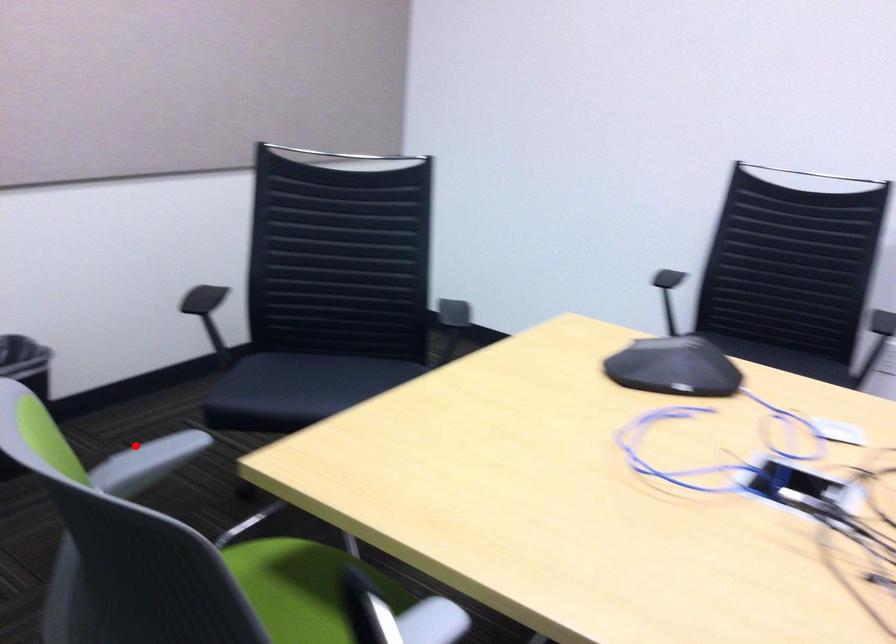
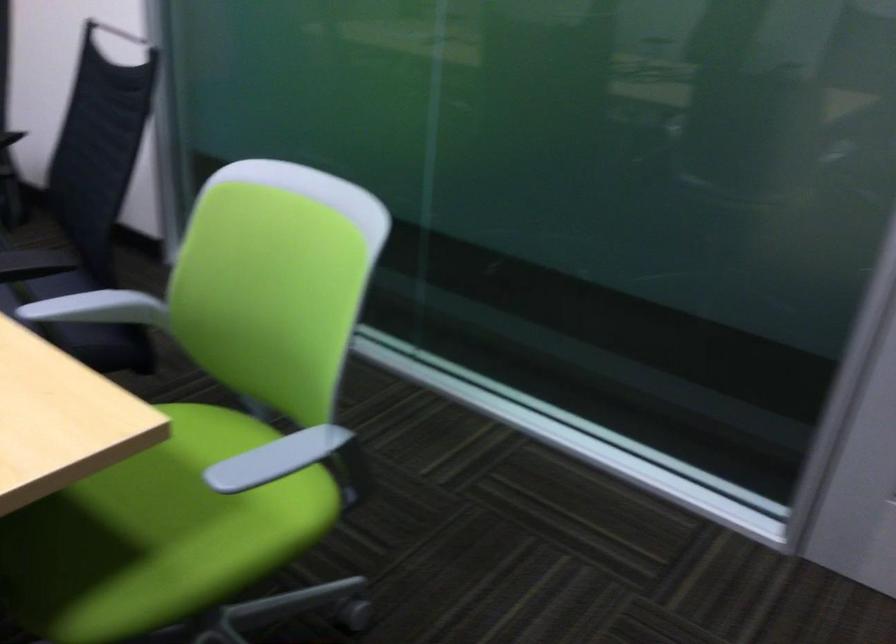
Question: I am providing you with two images of the same scene from different viewpoints. A red point is shown in image1. For the corresponding object point in image2, is it positioned nearer or farther from the camera?

Choices:
 (A) Nearer
 (B) Farther

Answer: (A)